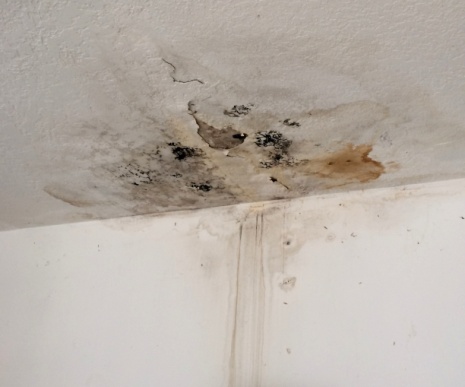
Locate an element on the screen. This screenshot has width=465, height=387. wall is located at coordinates (135, 306).